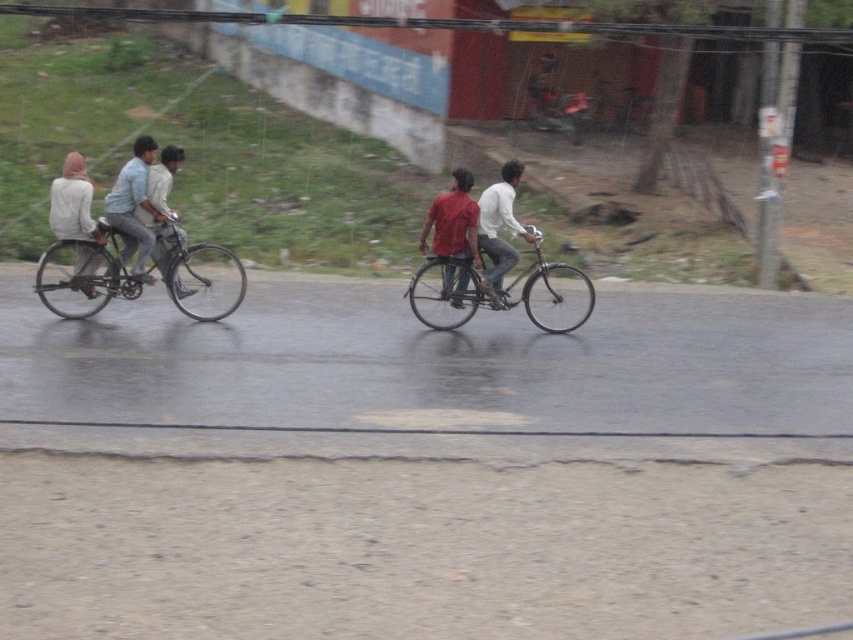
Question: Is white fabric headscarf at left smaller than light blue shirt at left?

Choices:
 (A) no
 (B) yes

Answer: (A)

Question: Which of these objects is positioned closest to the white fabric headscarf at left?

Choices:
 (A) light blue shirt at left
 (B) white matte shirt at center
 (C) metallic silver bicycle at center

Answer: (A)

Question: Which point appears closest to the camera in this image?

Choices:
 (A) (177, 276)
 (B) (515, 234)
 (C) (80, 164)

Answer: (C)

Question: Does shiny metallic bicycle at left appear on the right side of light blue denim shirt at left?

Choices:
 (A) no
 (B) yes

Answer: (B)

Question: Which point is closer to the camera?

Choices:
 (A) (440, 250)
 (B) (152, 246)
 (C) (146, 212)
 (D) (51, 289)

Answer: (D)

Question: Is metallic silver bicycle at center smaller than light blue denim shirt at left?

Choices:
 (A) no
 (B) yes

Answer: (B)